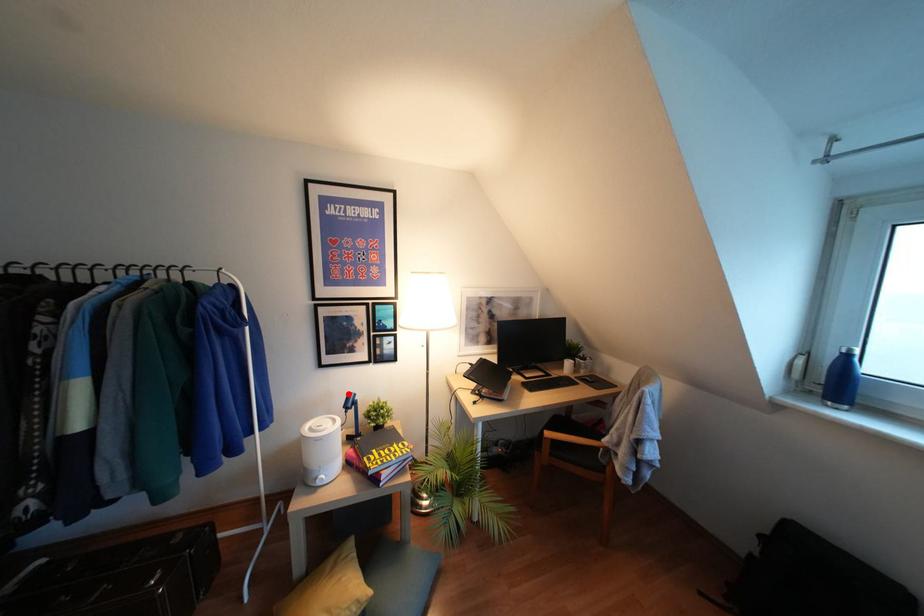
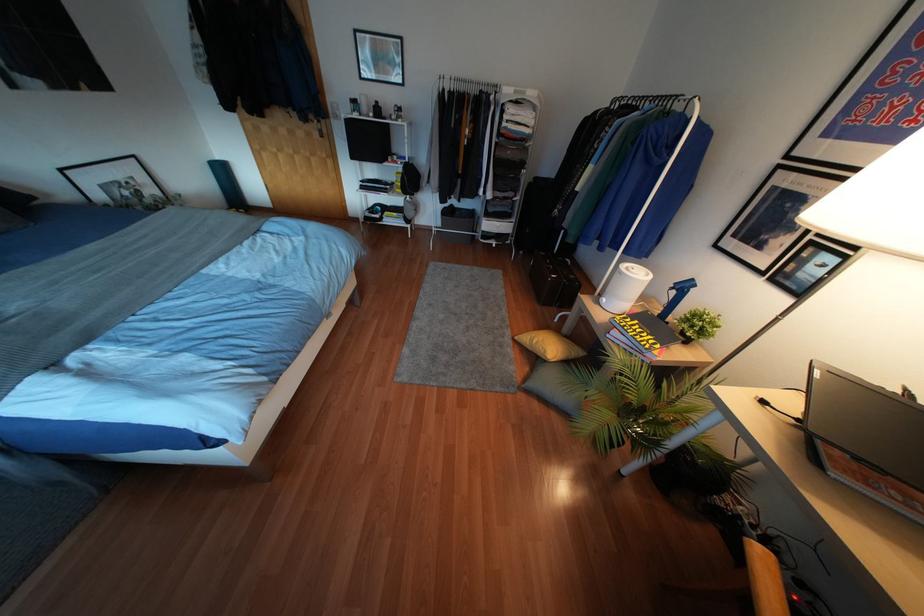
Question: I am providing you with two images of the same scene from different viewpoints. In image1, a red point is highlighted. Considering the same 3D point in image2, which of the following is correct?

Choices:
 (A) It is closer
 (B) It is farther

Answer: (A)